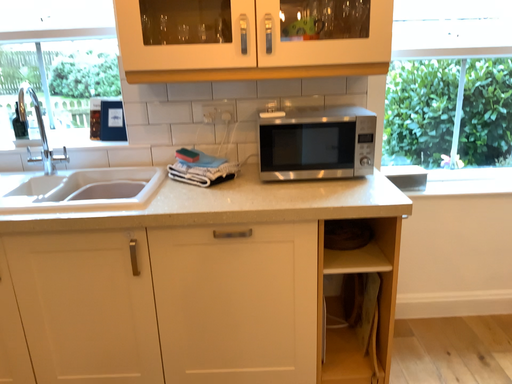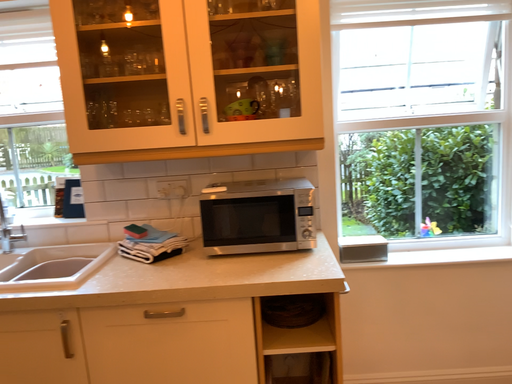
Question: How did the camera likely rotate when shooting the video?

Choices:
 (A) rotated downward
 (B) rotated upward

Answer: (B)